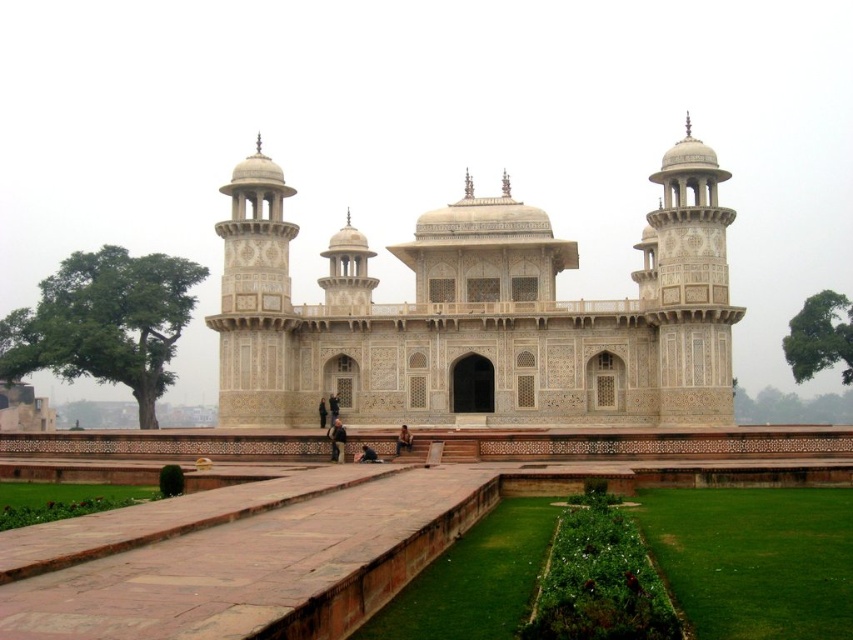
You are an architect examining the grand mausoleum structure. You notice a white marble palace at center and a dark brown leather jacket at center. Which object is positioned higher in the image?

The white marble palace at center is located above the dark brown leather jacket at center, so it is positioned higher in the image.

You are an architect visiting the grand mausoleum and notice a dark brown leather jacket at center and a white marble palace at center. Which object is positioned to the right of the other?

The white marble palace at center is to the right of the dark brown leather jacket at center according to the description.